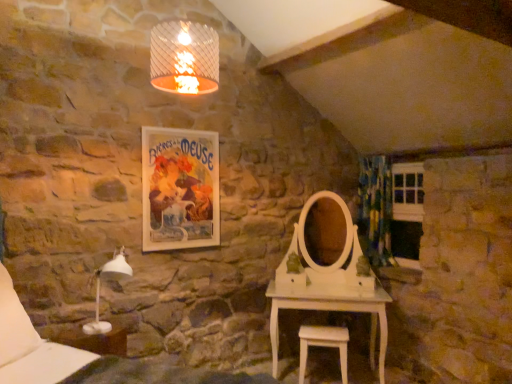
Question: From the image's perspective, is matte paper poster at upper center positioned above or below white plastic table lamp at lower left?

Choices:
 (A) below
 (B) above

Answer: (B)

Question: Based on their positions, is matte paper poster at upper center located to the left or right of white plastic table lamp at lower left?

Choices:
 (A) right
 (B) left

Answer: (A)

Question: Which object is the farthest from the white wooden window at right?

Choices:
 (A) white wood stool at lower center
 (B) green floral fabric curtain at right
 (C) matte paper poster at upper center
 (D) white soft pillow at lower left
 (E) white plastic table lamp at lower left

Answer: (D)

Question: Estimate the real-world distances between objects in this image. Which object is farther from the matte paper poster at upper center?

Choices:
 (A) white soft pillow at lower left
 (B) white wooden window at right
 (C) green floral fabric curtain at right
 (D) white plastic table lamp at lower left
 (E) white wood stool at lower center

Answer: (B)